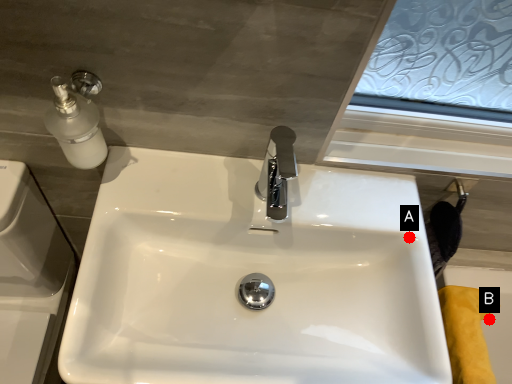
Question: Two points are circled on the image, labeled by A and B beside each circle. Which of the following is the farthest from the observer?

Choices:
 (A) A is further
 (B) B is further

Answer: (B)